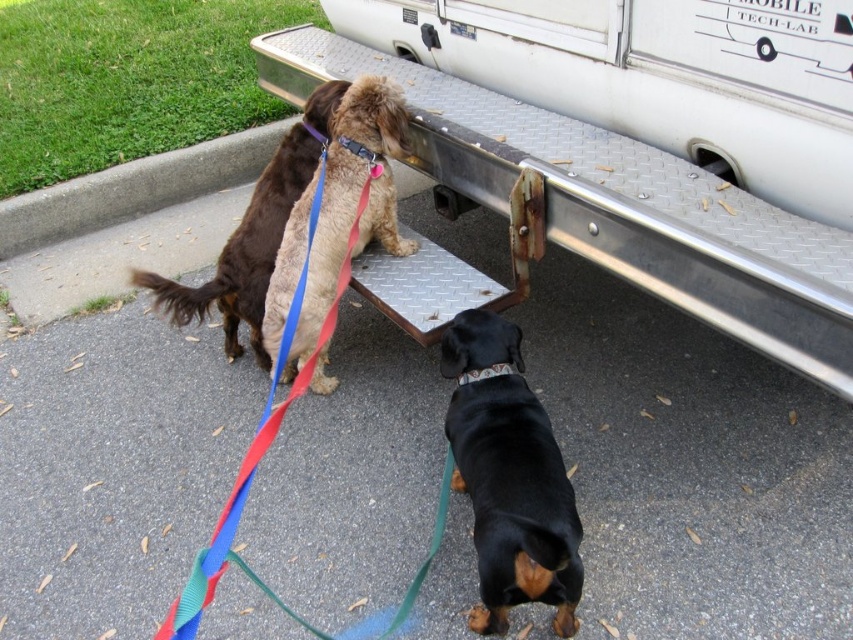
You are a delivery driver who needs to secure a package on the metallic trailer truck at upper center. However, you notice the black fabric neckband at center nearby. Which object should you prioritize interacting with first to ensure the package is safely loaded?

You should prioritize securing the metallic trailer truck at upper center first because it is positioned on the left side of the black fabric neckband at center, making it closer and more accessible for loading the package safely.

You are a photographer trying to position your camera at the origin point of a coordinate system. You want to capture the fuzzy brown dog at center in your shot. What are the coordinates where you should aim your camera to ensure the dog is centered?

The coordinates to aim the camera are at point (x=352, y=200) to center the fuzzy brown dog at center.

You are a photographer trying to capture both the fuzzy brown dog at center and the brown fuzzy dog at upper left in a single shot. Given their heights, which dog should you focus on first to ensure both are in frame?

The fuzzy brown dog at center is taller than the brown fuzzy dog at upper left, so focus on the taller dog first to adjust the camera angle for both.